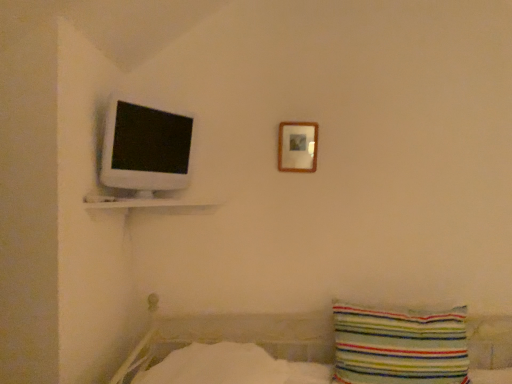
Question: Is wooden picture frame at upper center in front of or behind white glossy computer monitor at upper left in the image?

Choices:
 (A) behind
 (B) front

Answer: (A)

Question: From the image's perspective, is wooden picture frame at upper center located above or below white glossy computer monitor at upper left?

Choices:
 (A) above
 (B) below

Answer: (A)

Question: Which object is positioned closest to the white glossy shelf at upper left?

Choices:
 (A) wooden picture frame at upper center
 (B) white soft bedsheet at lower center
 (C) white glossy computer monitor at upper left
 (D) striped fabric pillow at lower right

Answer: (C)

Question: Based on their relative distances, which object is farther from the white glossy shelf at upper left?

Choices:
 (A) white glossy computer monitor at upper left
 (B) striped fabric pillow at lower right
 (C) wooden picture frame at upper center
 (D) white soft bedsheet at lower center

Answer: (B)